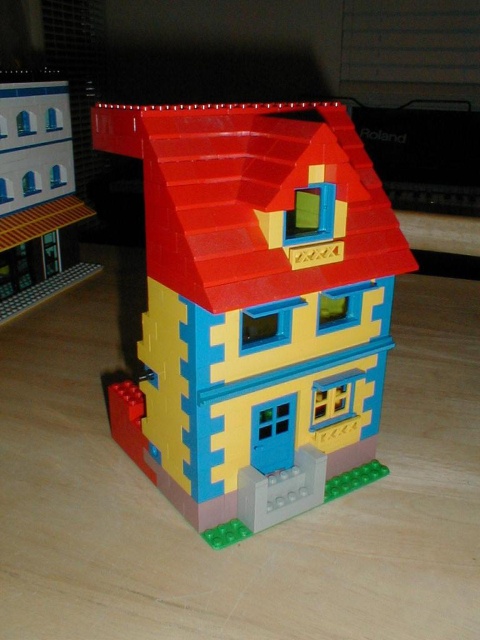
Question: Does brick-like plastic house at center have a greater width compared to smooth white building at upper left?

Choices:
 (A) no
 (B) yes

Answer: (B)

Question: Does brick-like plastic house at center appear on the left side of smooth white building at upper left?

Choices:
 (A) yes
 (B) no

Answer: (B)

Question: Among these objects, which one is farthest from the camera?

Choices:
 (A) brick-like plastic house at center
 (B) smooth white building at upper left

Answer: (B)

Question: Among these points, which one is farthest from the camera?

Choices:
 (A) tap(340, 417)
 (B) tap(29, 99)

Answer: (B)

Question: In this image, where is brick-like plastic house at center located relative to smooth white building at upper left?

Choices:
 (A) left
 (B) right

Answer: (B)

Question: Which of the following is the closest to the observer?

Choices:
 (A) (10, 236)
 (B) (159, 186)

Answer: (B)